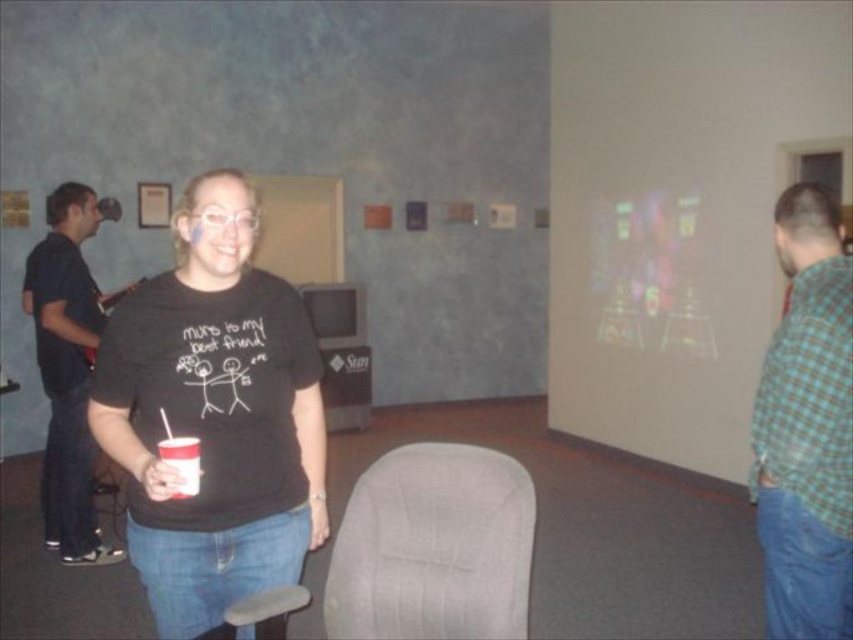
You are a photographer at the event and want to take a photo of the dark blue shirt at left and the white plastic cup at center. Which object should you focus on first if you want to capture both in the same frame without moving the camera?

The dark blue shirt at left is much taller than the white plastic cup at center, so you should focus on the dark blue shirt at left first to ensure it is in focus before the white plastic cup at center.